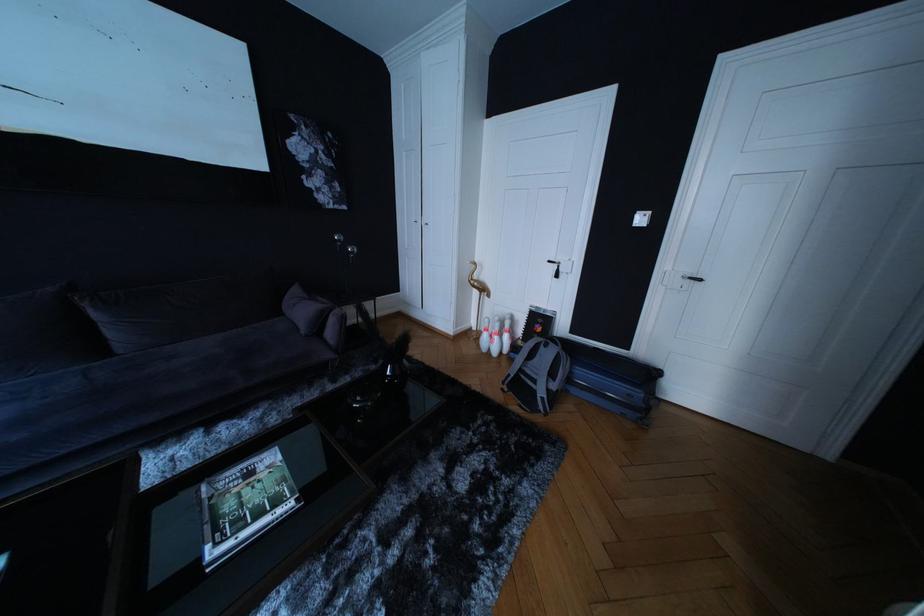
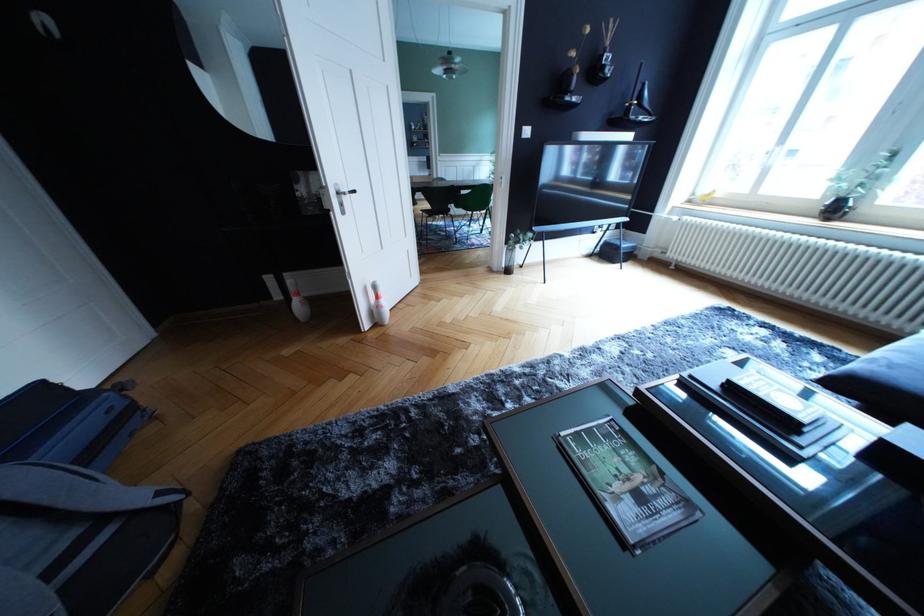
The point at (x=259, y=480) is marked in the first image. Where is the corresponding point in the second image?

(649, 504)